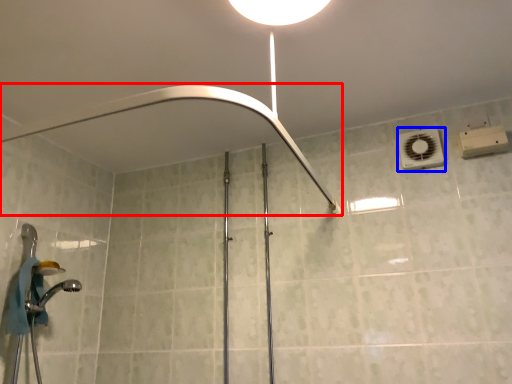
Question: Which object is closer to the camera taking this photo, shower (highlighted by a red box) or air conditioner (highlighted by a blue box)?

Choices:
 (A) shower
 (B) air conditioner

Answer: (A)